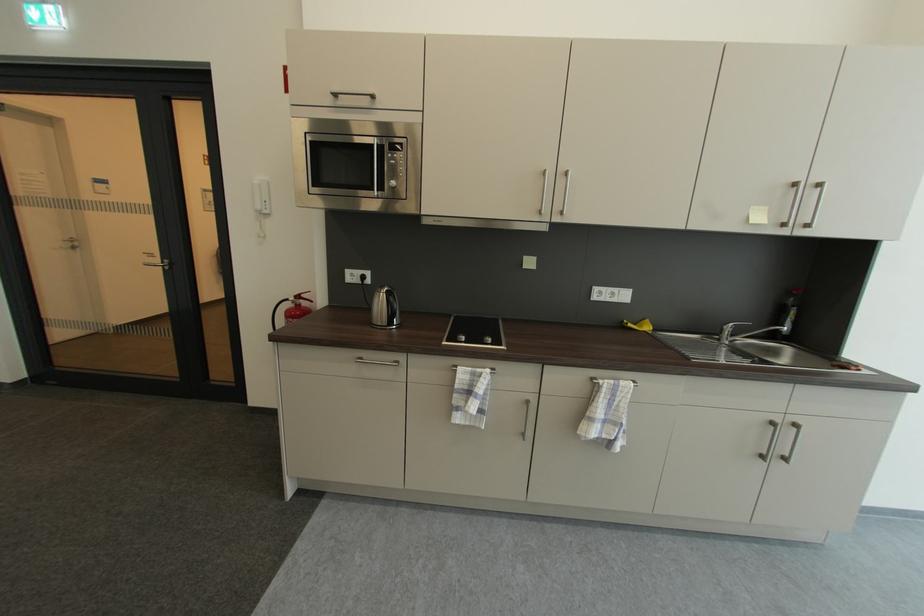
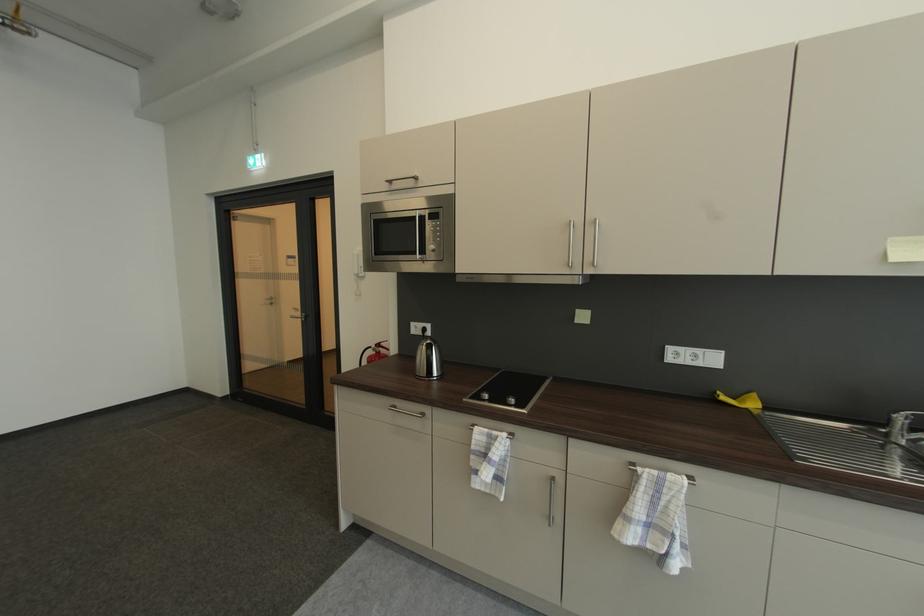
Where in the second image is the point corresponding to point (723, 339) from the first image?

(892, 432)